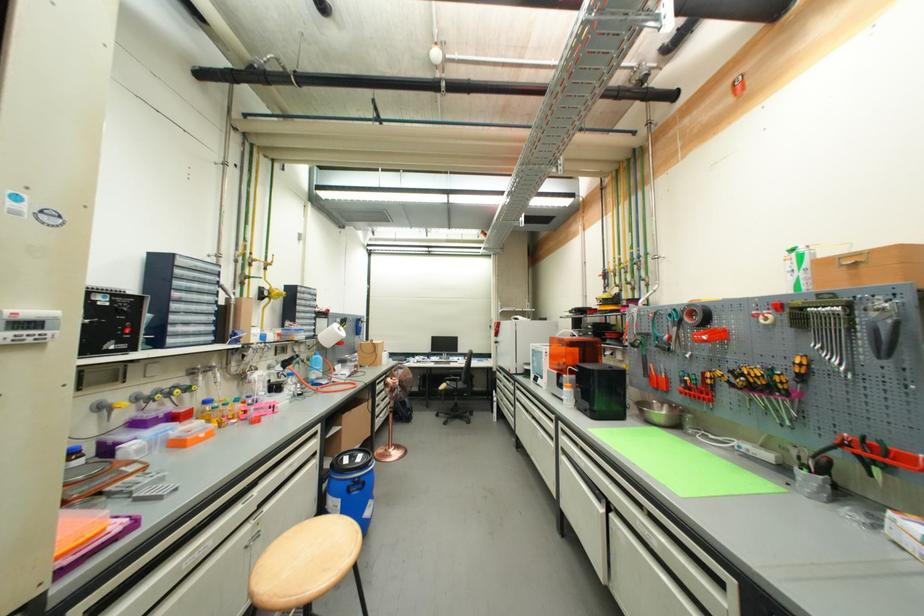
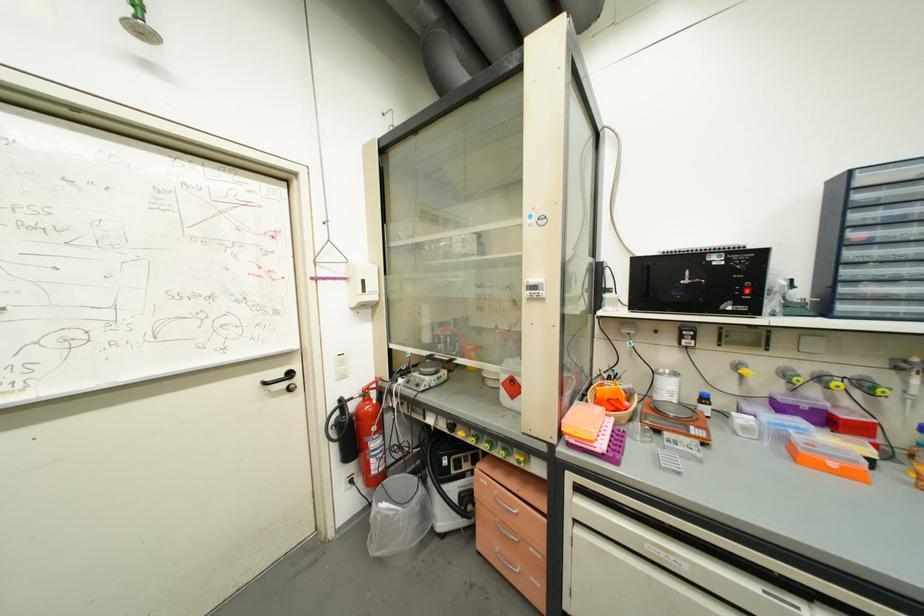
Where in the second image is the point corresponding to point 130,329 from the first image?

(748, 288)